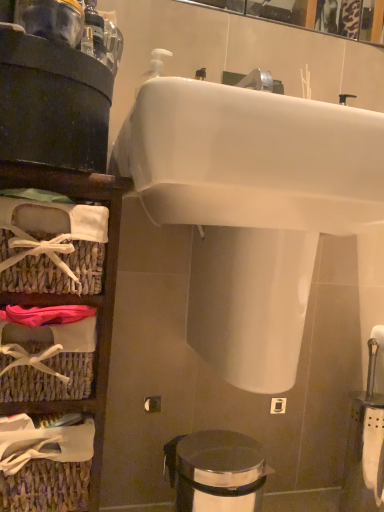
Question: Is polished stainless steel trash can at lower center turned away from woven wicker basket at left?

Choices:
 (A) no
 (B) yes

Answer: (A)

Question: From a real-world perspective, is polished stainless steel trash can at lower center positioned under woven wicker basket at left based on gravity?

Choices:
 (A) yes
 (B) no

Answer: (A)

Question: Is polished stainless steel trash can at lower center closer to camera compared to woven wicker basket at left?

Choices:
 (A) no
 (B) yes

Answer: (A)

Question: Is polished stainless steel trash can at lower center located outside woven wicker basket at left?

Choices:
 (A) no
 (B) yes

Answer: (B)

Question: Are polished stainless steel trash can at lower center and woven wicker basket at left far apart?

Choices:
 (A) no
 (B) yes

Answer: (A)

Question: Does polished stainless steel trash can at lower center have a greater height compared to woven wicker basket at left?

Choices:
 (A) no
 (B) yes

Answer: (A)

Question: Is woven wicker basket at left located outside white glossy sink at upper center?

Choices:
 (A) yes
 (B) no

Answer: (A)

Question: Are woven wicker basket at left and white glossy sink at upper center far apart?

Choices:
 (A) no
 (B) yes

Answer: (A)

Question: Is woven wicker basket at left next to white glossy sink at upper center and touching it?

Choices:
 (A) no
 (B) yes

Answer: (A)

Question: Does woven wicker basket at left have a lesser width compared to white glossy sink at upper center?

Choices:
 (A) no
 (B) yes

Answer: (B)

Question: Can you confirm if woven wicker basket at left is taller than white glossy sink at upper center?

Choices:
 (A) yes
 (B) no

Answer: (A)

Question: From the image's perspective, would you say woven wicker basket at left is shown under white glossy sink at upper center?

Choices:
 (A) yes
 (B) no

Answer: (A)

Question: Is white glossy sink at upper center oriented towards woven wicker basket at left?

Choices:
 (A) no
 (B) yes

Answer: (A)